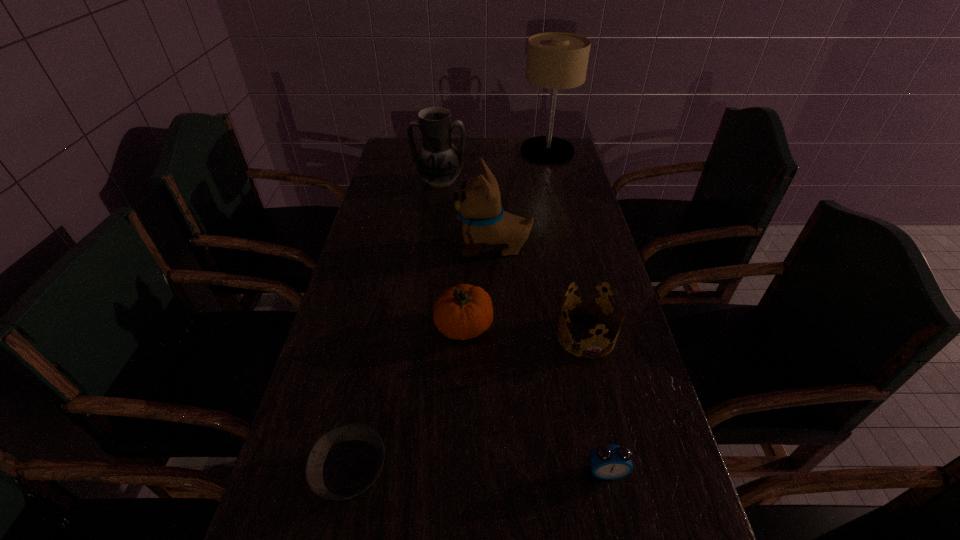
Locate an element on the screen. vacant position located 0.250m on the face of the fifth nearest object is located at coordinates (371, 247).

Locate an element on the screen. The height and width of the screenshot is (540, 960). free space located 0.150m on the face of the fifth nearest object is located at coordinates (405, 247).

Where is `vacant space positioned on the front-facing side of the pitcher`? The height and width of the screenshot is (540, 960). vacant space positioned on the front-facing side of the pitcher is located at coordinates (434, 228).

Find the location of a particular element. The height and width of the screenshot is (540, 960). vacant space located 0.200m on the left of the pumpkin is located at coordinates (352, 329).

Find the location of `vacant space located on the back of the crown`. vacant space located on the back of the crown is located at coordinates (565, 242).

The height and width of the screenshot is (540, 960). In order to click on free space located 0.160m on the back of the bowl in this screenshot , I will do `click(372, 369)`.

Where is `object that is at the far edge`? This screenshot has width=960, height=540. object that is at the far edge is located at coordinates (555, 60).

The image size is (960, 540). Find the location of `pitcher that is positioned at the left edge`. pitcher that is positioned at the left edge is located at coordinates (438, 162).

What are the coordinates of `bowl present at the left edge` in the screenshot? It's located at (344, 462).

The width and height of the screenshot is (960, 540). What are the coordinates of `table lamp present at the right edge` in the screenshot? It's located at (555, 60).